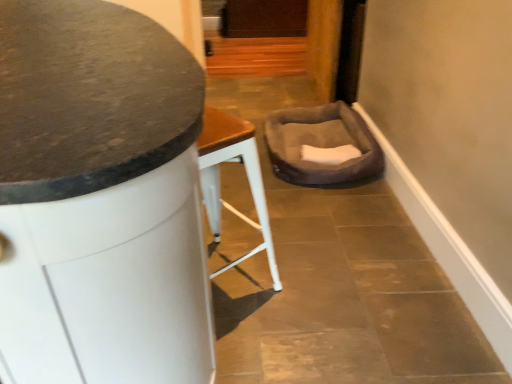
Question: Is granite countertop at center in front of brown plush pet bed at center?

Choices:
 (A) no
 (B) yes

Answer: (B)

Question: Is granite countertop at center aimed at brown plush pet bed at center?

Choices:
 (A) no
 (B) yes

Answer: (A)

Question: Is granite countertop at center facing away from brown plush pet bed at center?

Choices:
 (A) yes
 (B) no

Answer: (B)

Question: From the image's perspective, would you say granite countertop at center is positioned over brown plush pet bed at center?

Choices:
 (A) yes
 (B) no

Answer: (B)

Question: Are granite countertop at center and brown plush pet bed at center beside each other?

Choices:
 (A) no
 (B) yes

Answer: (A)

Question: Can you confirm if granite countertop at center is positioned to the left of brown plush pet bed at center?

Choices:
 (A) yes
 (B) no

Answer: (A)

Question: Is brown plush pet bed at center further to the viewer compared to granite countertop at center?

Choices:
 (A) yes
 (B) no

Answer: (A)

Question: From the image's perspective, does brown plush pet bed at center appear lower than granite countertop at center?

Choices:
 (A) no
 (B) yes

Answer: (A)

Question: Is brown plush pet bed at center bigger than granite countertop at center?

Choices:
 (A) no
 (B) yes

Answer: (A)

Question: Considering the relative sizes of brown plush pet bed at center and granite countertop at center in the image provided, is brown plush pet bed at center taller than granite countertop at center?

Choices:
 (A) no
 (B) yes

Answer: (A)

Question: Considering the relative positions of brown plush pet bed at center and granite countertop at center in the image provided, is brown plush pet bed at center to the right of granite countertop at center from the viewer's perspective?

Choices:
 (A) no
 (B) yes

Answer: (B)

Question: Is brown plush pet bed at center facing away from granite countertop at center?

Choices:
 (A) no
 (B) yes

Answer: (A)

Question: Considering the positions of point (75, 321) and point (301, 163), is point (75, 321) closer or farther from the camera than point (301, 163)?

Choices:
 (A) closer
 (B) farther

Answer: (A)